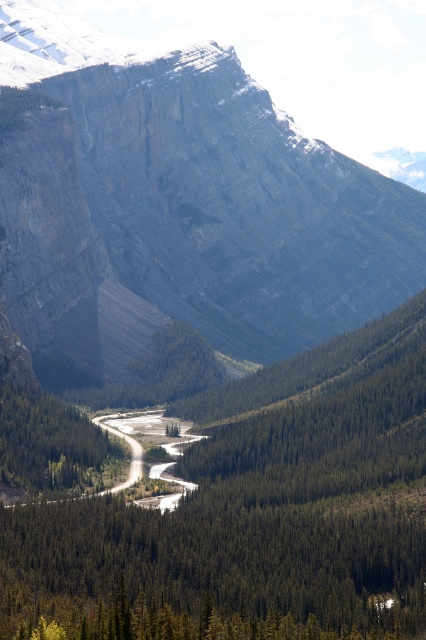
Question: Among these objects, which one is nearest to the camera?

Choices:
 (A) gray rock cliff at upper center
 (B) gravel road at center
 (C) green matte tree at lower left
 (D) green matte tree at center

Answer: (D)

Question: Can you confirm if gray rock cliff at upper center is positioned to the left of gravel road at center?

Choices:
 (A) no
 (B) yes

Answer: (B)

Question: Which object is closer to the camera taking this photo?

Choices:
 (A) gray rock cliff at upper center
 (B) gravel road at center
 (C) green matte tree at lower left

Answer: (C)

Question: Can you confirm if green matte tree at lower left is positioned to the left of gravel road at center?

Choices:
 (A) yes
 (B) no

Answer: (A)

Question: Considering the relative positions of green matte tree at center and gravel road at center in the image provided, where is green matte tree at center located with respect to gravel road at center?

Choices:
 (A) left
 (B) right

Answer: (B)

Question: Which object is the closest to the green matte tree at lower left?

Choices:
 (A) gravel road at center
 (B) gray rock cliff at upper center
 (C) green matte tree at center

Answer: (A)